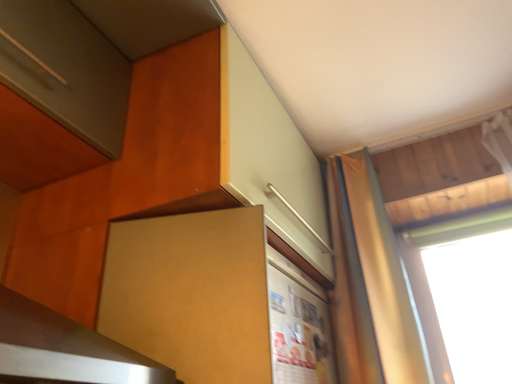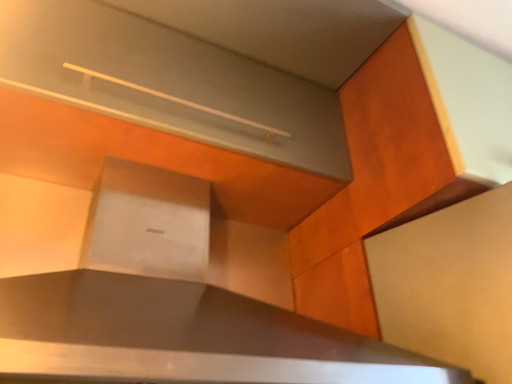
Question: How did the camera likely rotate when shooting the video?

Choices:
 (A) rotated right
 (B) rotated left

Answer: (B)